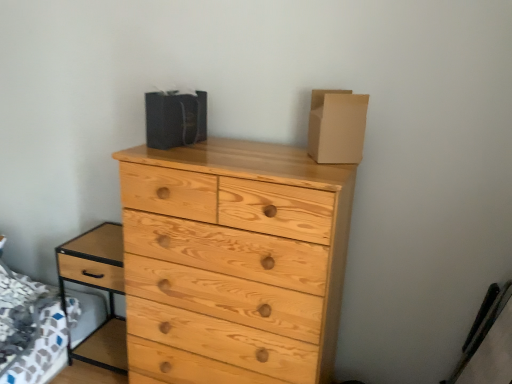
Question: Considering their positions, is light brown wood nightstand at lower left located in front of or behind brown cardboard box at upper right, which appears as the 1th cardboard box when viewed from the right?

Choices:
 (A) behind
 (B) front

Answer: (A)

Question: Is point (68, 258) positioned closer to the camera than point (334, 104)?

Choices:
 (A) farther
 (B) closer

Answer: (A)

Question: Which is farther from the natural wood chest of drawers at center?

Choices:
 (A) matte black bag at upper center, positioned as the 1th cardboard box in left-to-right order
 (B) brown cardboard box at upper right, the second cardboard box viewed from the left
 (C) light brown wood nightstand at lower left

Answer: (C)

Question: Considering the real-world distances, which object is closest to the natural wood chest of drawers at center?

Choices:
 (A) light brown wood nightstand at lower left
 (B) matte black bag at upper center, positioned as the 1th cardboard box in left-to-right order
 (C) brown cardboard box at upper right, which appears as the 1th cardboard box when viewed from the right

Answer: (C)